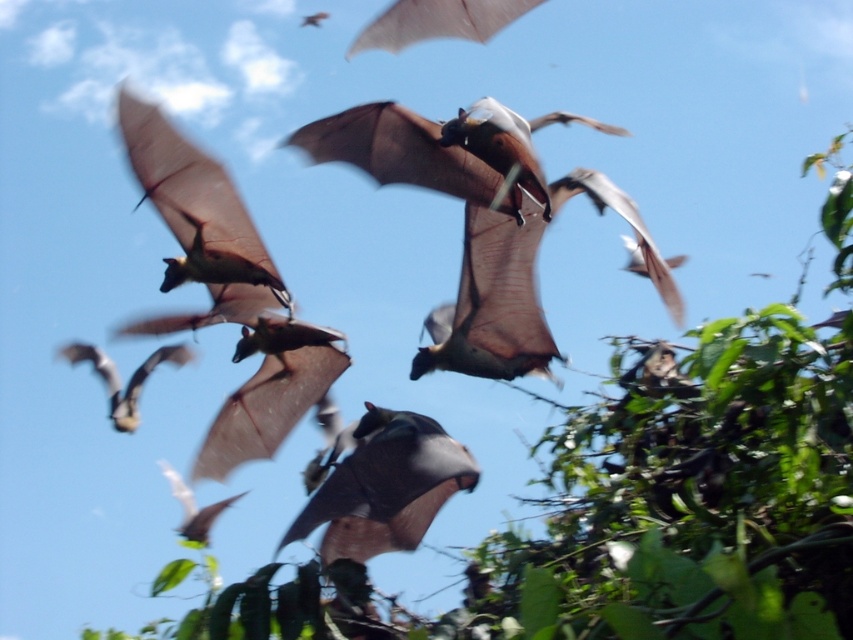
Who is more distant from viewer, (590, 554) or (350, 552)?

→ The point (350, 552) is behind.

Is point (831, 154) in front of point (396, 442)?

That is True.

Locate an element on the screen. Image resolution: width=853 pixels, height=640 pixels. green leafy tree at center is located at coordinates (612, 502).